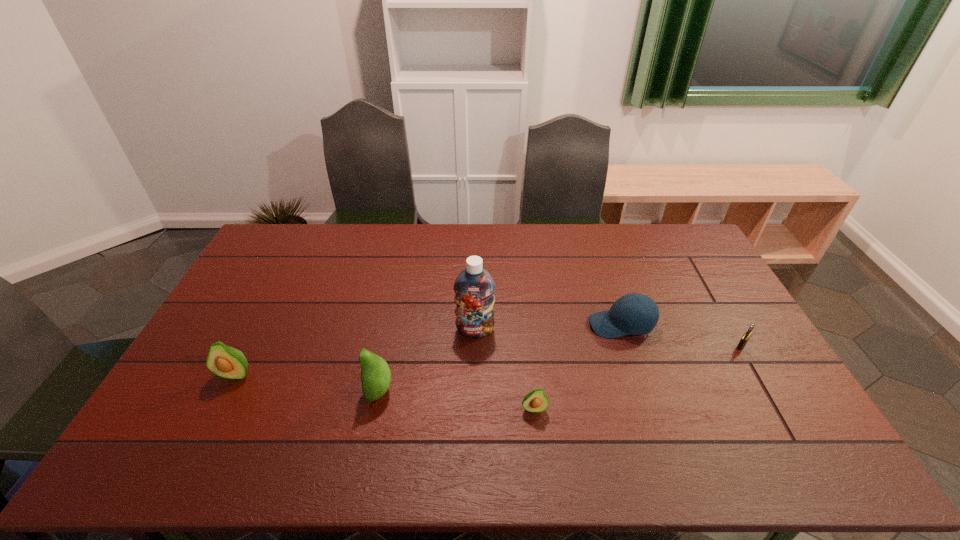
In order to click on object at the right edge in this screenshot , I will do `click(746, 336)`.

This screenshot has height=540, width=960. In the image, there is a desktop. What are the coordinates of `vacant area at the far edge` in the screenshot? It's located at (309, 238).

In the image, there is a desktop. Where is `free space at the near edge`? This screenshot has height=540, width=960. free space at the near edge is located at coordinates (615, 422).

Locate an element on the screen. The width and height of the screenshot is (960, 540). vacant area at the left edge of the desktop is located at coordinates pos(262,281).

This screenshot has width=960, height=540. Find the location of `vacant space at the right edge of the desktop`. vacant space at the right edge of the desktop is located at coordinates (739, 362).

The height and width of the screenshot is (540, 960). What are the coordinates of `vacant space at the near right corner of the desktop` in the screenshot? It's located at (769, 426).

Identify the location of free area in between the fourth nearest object and the second object from left to right. This screenshot has height=540, width=960. (561, 368).

The image size is (960, 540). What are the coordinates of `empty location between the padlock and the second object from left to right` in the screenshot? It's located at (561, 368).

Identify the location of blank region between the fifth object from left to right and the shortest avocado. Image resolution: width=960 pixels, height=540 pixels. click(x=578, y=367).

Where is `free spot between the second tallest avocado and the second avocado from left to right`? The height and width of the screenshot is (540, 960). free spot between the second tallest avocado and the second avocado from left to right is located at coordinates (307, 382).